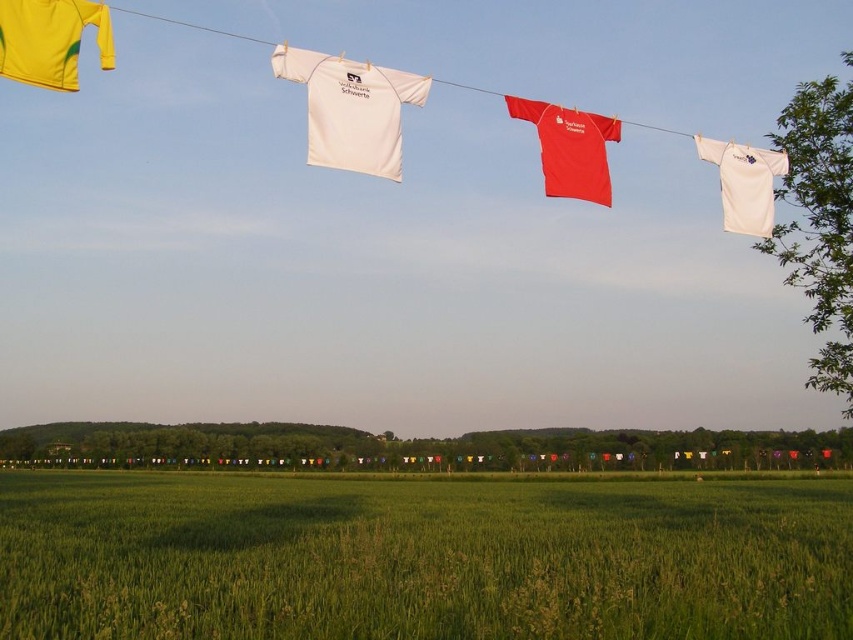
You are standing in the rural landscape looking at the clothesline. There are two points marked on the clothesline at coordinates point (62, 512) and point (850, 336). Which point is closer to you?

Point (62, 512) is closer to you because it is further to the camera than point (850, 336).